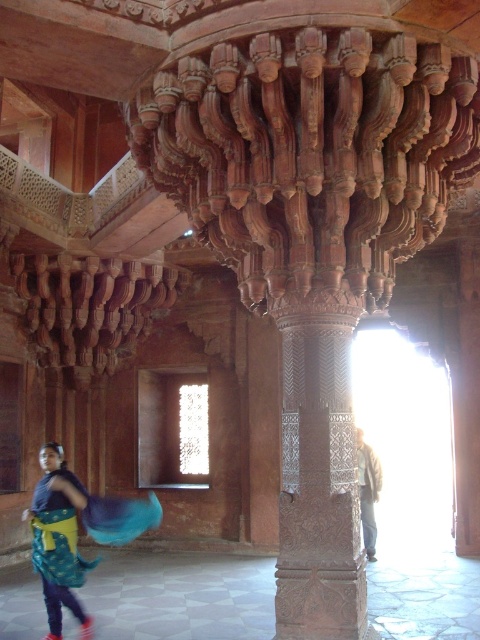
You are an interior designer assessing the placement of furniture in a traditional room. You see the brown carved column at center and the teal fabric skirt at lower left. Which object is positioned to the right side of the other?

The brown carved column at center is to the right of teal fabric skirt at lower left.

You are an interior designer assessing the spatial compatibility of two items in a room. You have the teal fabric skirt at lower left and the light brown leather jacket at right. Given their sizes, which one would you recommend placing in a smaller designated area?

The light brown leather jacket at right is smaller than the teal fabric skirt at lower left, so it would be more suitable for placement in a smaller designated area.